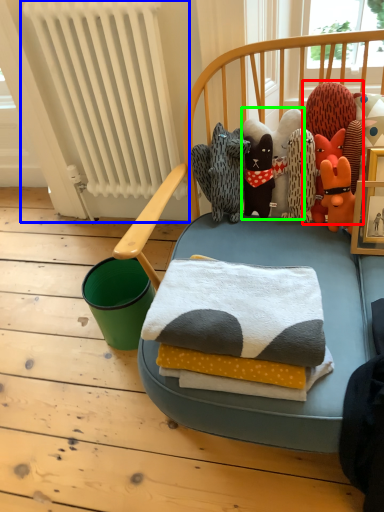
Question: Which is nearer to the toy (highlighted by a red box)? radiator (highlighted by a blue box) or toy (highlighted by a green box).

Choices:
 (A) radiator
 (B) toy

Answer: (B)